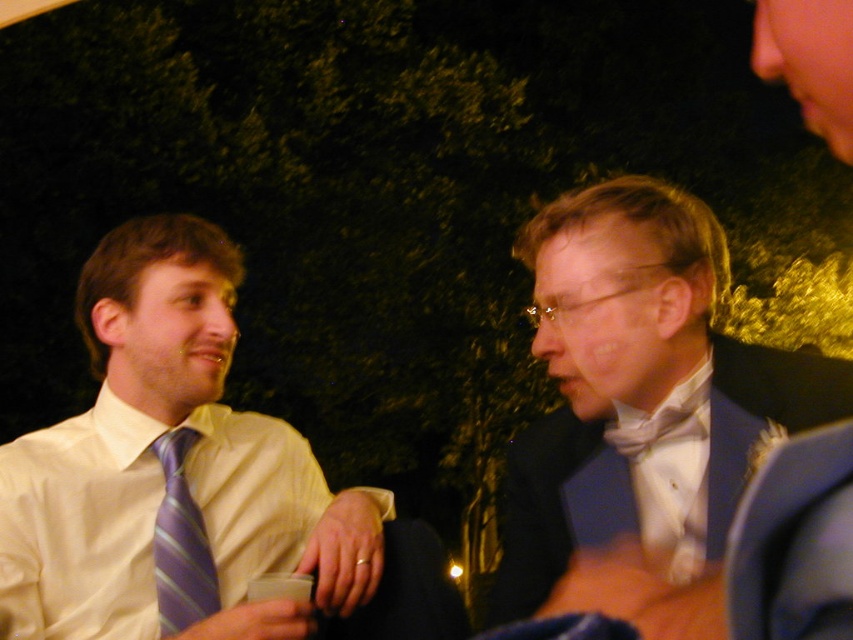
Question: Which point is farther from the camera taking this photo?

Choices:
 (A) (259, 636)
 (B) (595, 209)
 (C) (701, 410)

Answer: (B)

Question: Is white satin shirt at left to the right of white satin bow tie at center from the viewer's perspective?

Choices:
 (A) no
 (B) yes

Answer: (A)

Question: Estimate the real-world distances between objects in this image. Which object is closer to the white satin dress shirt at center?

Choices:
 (A) purple striped tie at left
 (B) shiny blue suit at center

Answer: (B)

Question: Is white satin shirt at left further to camera compared to shiny blue suit at center?

Choices:
 (A) yes
 (B) no

Answer: (A)

Question: Which point is farther from the camera taking this photo?

Choices:
 (A) (672, 426)
 (B) (630, 528)
 (C) (36, 433)

Answer: (C)

Question: Is purple striped tie at left above white satin bow tie at center?

Choices:
 (A) no
 (B) yes

Answer: (A)